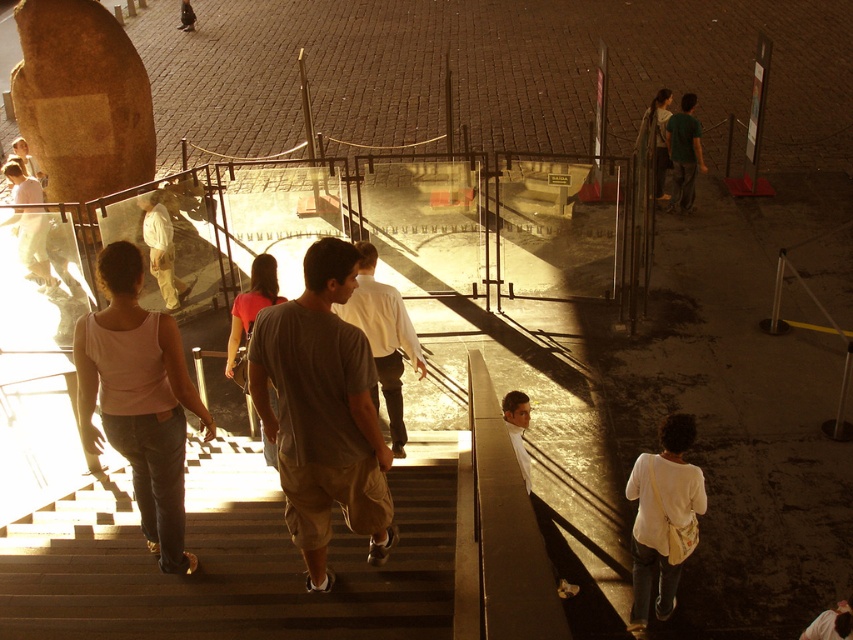
You are a photographer trying to capture a closeup of the pink fabric tank top at center and the white fabric bag at lower right. Which object should you zoom in on to ensure both fit in the frame without cropping?

The pink fabric tank top at center has a larger width than the white fabric bag at lower right, so you should zoom in on the pink fabric tank top at center to ensure both fit in the frame without cropping.

You are standing at the base of the monument and want to take a photo of the point marked at coordinate point (x=173, y=396). If your camera has a focal length of 50mm and you are 4.53 meters away from the point, what is the angle of view required to capture the point in the center of your photo?

The point (x=173, y=396) is 4.53 meters away from the camera. To calculate the angle of view needed, use the formula for angle of view which is 2 times arctangent of the sensor size divided by 2 times the focal length. However, without knowing the sensor size, we can state that the distance is sufficient for most standard lenses to capture the point if aimed correctly.